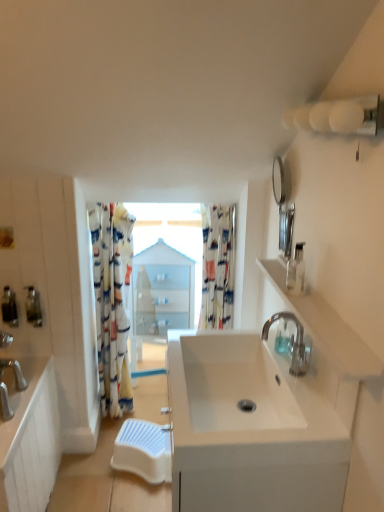
Question: Can you confirm if translucent plastic soap dispenser at left, which is the 3th soap dispenser from front to back, is smaller than white glossy sink at right?

Choices:
 (A) no
 (B) yes

Answer: (B)

Question: Is translucent plastic soap dispenser at left, which is the 3th soap dispenser from front to back, outside of white glossy sink at right?

Choices:
 (A) yes
 (B) no

Answer: (A)

Question: Is translucent plastic soap dispenser at left, which is the 3th soap dispenser from front to back, shorter than white glossy sink at right?

Choices:
 (A) yes
 (B) no

Answer: (B)

Question: Is translucent plastic soap dispenser at left, the 2th soap dispenser positioned from the right, positioned before white glossy sink at right?

Choices:
 (A) yes
 (B) no

Answer: (B)

Question: From a real-world perspective, is translucent plastic soap dispenser at left, which is counted as the 1th soap dispenser, starting from the back, beneath white glossy sink at right?

Choices:
 (A) yes
 (B) no

Answer: (A)

Question: Can you confirm if translucent plastic soap dispenser at left, which is counted as the 1th soap dispenser, starting from the back, is taller than white glossy sink at right?

Choices:
 (A) no
 (B) yes

Answer: (B)

Question: Considering the relative sizes of white glossy medicine cabinet at center and polished chrome faucet at center right in the image provided, is white glossy medicine cabinet at center taller than polished chrome faucet at center right?

Choices:
 (A) no
 (B) yes

Answer: (B)

Question: Is white glossy medicine cabinet at center to the right of polished chrome faucet at center right from the viewer's perspective?

Choices:
 (A) no
 (B) yes

Answer: (A)

Question: Is white glossy medicine cabinet at center facing towards polished chrome faucet at center right?

Choices:
 (A) yes
 (B) no

Answer: (A)

Question: Is white glossy medicine cabinet at center next to polished chrome faucet at center right and touching it?

Choices:
 (A) yes
 (B) no

Answer: (B)

Question: Is white glossy medicine cabinet at center not close to polished chrome faucet at center right?

Choices:
 (A) yes
 (B) no

Answer: (B)

Question: Does white glossy medicine cabinet at center have a lesser height compared to polished chrome faucet at center right?

Choices:
 (A) no
 (B) yes

Answer: (A)

Question: From the image's perspective, is translucent plastic soap dispenser at left, the 2th soap dispenser positioned from the right, above satin nickel cabinet at left?

Choices:
 (A) yes
 (B) no

Answer: (A)